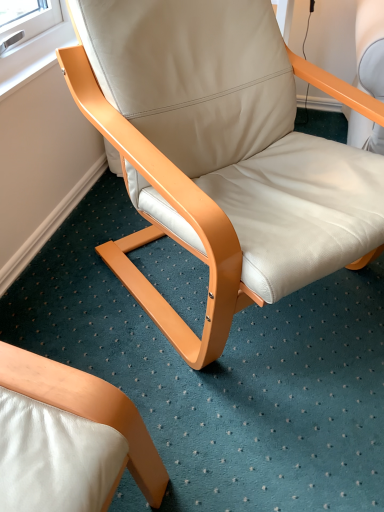
What do you see at coordinates (222, 154) in the screenshot?
I see `beige leather chair at center` at bounding box center [222, 154].

Locate an element on the screen. beige leather chair at center is located at coordinates (222, 154).

You are a GUI agent. You are given a task and a screenshot of the screen. Output one action in this format:
    pyautogui.click(x=<x>, y=<y>)
    Task: Click on the beige leather chair at center
    
    Given the screenshot: What is the action you would take?
    pyautogui.click(x=222, y=154)